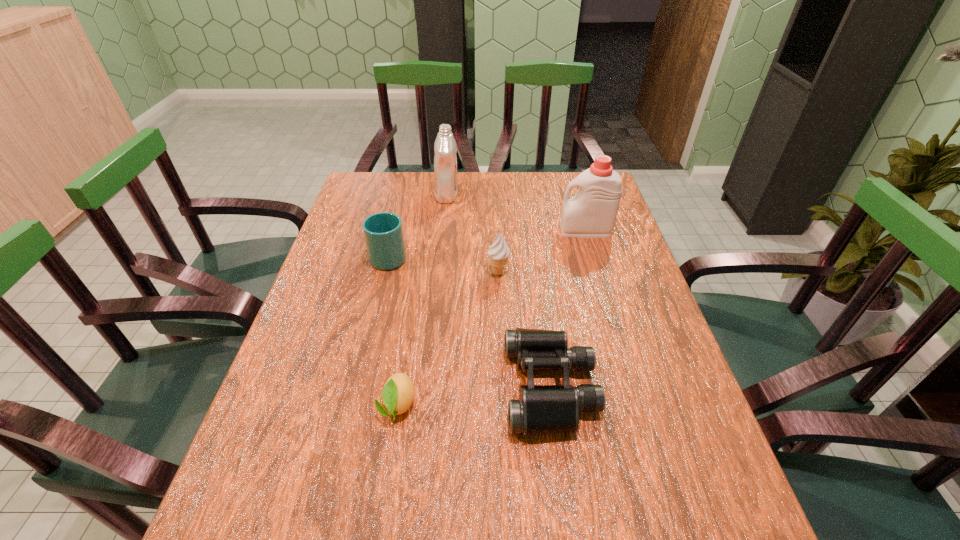
The image size is (960, 540). I want to click on free space between the right detergent and the binoculars, so click(568, 309).

This screenshot has width=960, height=540. I want to click on free space between the leftmost object and the fifth nearest object, so click(488, 243).

Where is `vacant region between the leftmost object and the right detergent`? vacant region between the leftmost object and the right detergent is located at coordinates (488, 243).

You are a GUI agent. You are given a task and a screenshot of the screen. Output one action in this format:
    pyautogui.click(x=<x>, y=<y>)
    Task: Click on the unoccupied position between the farthest object and the binoculars
    The image size is (960, 540).
    Given the screenshot: What is the action you would take?
    pyautogui.click(x=498, y=291)

Locate an element on the screen. empty space between the icecream and the farther detergent is located at coordinates (472, 234).

At what (x,y) coordinates should I click in order to perform the action: click on free spot between the lemon and the leftmost object. Please return your answer as a coordinate pair (x, y). Looking at the image, I should click on (394, 330).

At what (x,y) coordinates should I click in order to perform the action: click on empty location between the shortest object and the leftmost object. Please return your answer as a coordinate pair (x, y). The height and width of the screenshot is (540, 960). Looking at the image, I should click on (394, 330).

The width and height of the screenshot is (960, 540). What are the coordinates of `vacant point located between the lemon and the binoculars` in the screenshot? It's located at [474, 396].

Identify the location of object that stands as the closest to the farther detergent. The width and height of the screenshot is (960, 540). (383, 232).

Choose which object is the fifth nearest neighbor to the icecream. Please provide its 2D coordinates. Your answer should be formatted as a tuple, i.e. [(x, y)], where the tuple contains the x and y coordinates of a point satisfying the conditions above.

[(397, 396)]